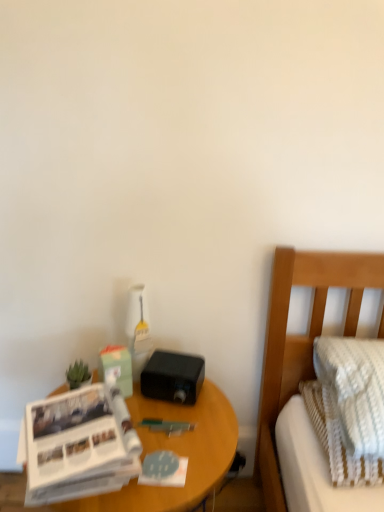
Identify the location of free space above white paper at left (from a real-world perspective). (58, 431).